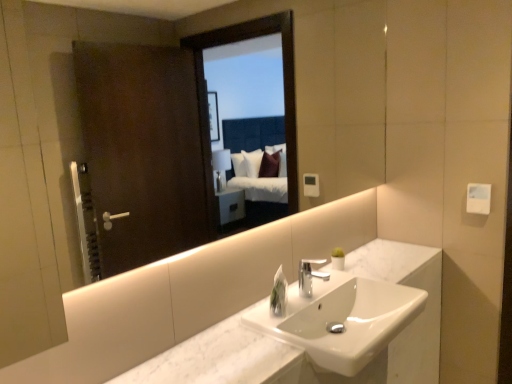
You are a GUI agent. You are given a task and a screenshot of the screen. Output one action in this format:
    pyautogui.click(x=<x>, y=<y>)
    Task: Click on the free space that is in between clear plastic soap dispenser at center and silver metallic faucet at center
    The width and height of the screenshot is (512, 384).
    Given the screenshot: What is the action you would take?
    pyautogui.click(x=291, y=306)